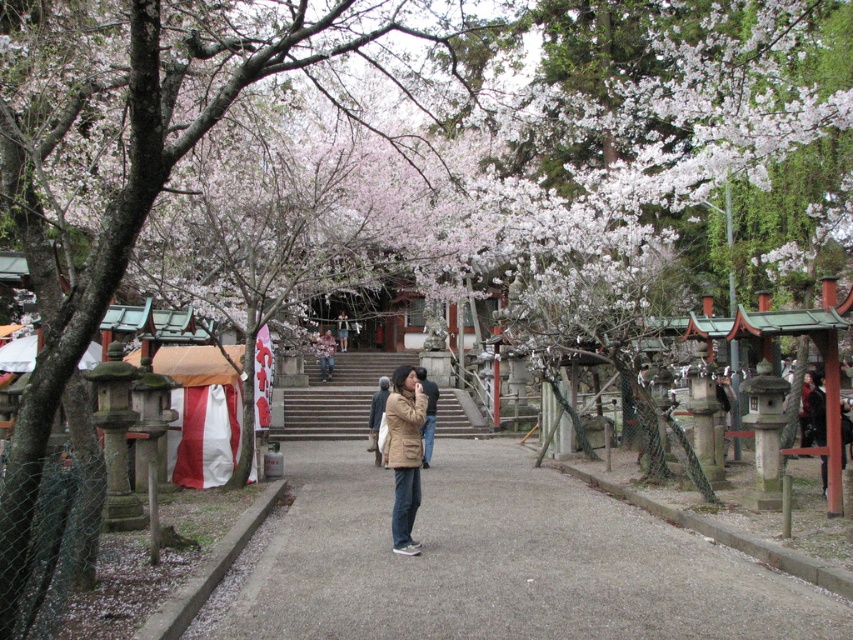
Question: Does gray gravel pavement at center have a greater width compared to brown leather jacket at center?

Choices:
 (A) yes
 (B) no

Answer: (A)

Question: Which of these objects is positioned closest to the gray gravel pavement at center?

Choices:
 (A) brown leather jacket at center
 (B) brown matte jacket at center

Answer: (B)

Question: Is gray gravel pavement at center to the left of brown leather jacket at center from the viewer's perspective?

Choices:
 (A) no
 (B) yes

Answer: (A)

Question: Which object appears farthest from the camera in this image?

Choices:
 (A) gray gravel pavement at center
 (B) brown leather jacket at center
 (C) brown matte jacket at center

Answer: (B)

Question: From the image, what is the correct spatial relationship of gray gravel pavement at center in relation to brown matte jacket at center?

Choices:
 (A) left
 (B) right

Answer: (B)

Question: Considering the real-world distances, which object is closest to the gray gravel pavement at center?

Choices:
 (A) brown matte jacket at center
 (B) brown leather jacket at center

Answer: (A)